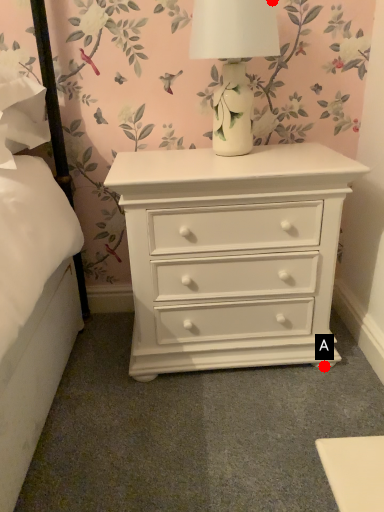
Question: Two points are circled on the image, labeled by A and B beside each circle. Among these points, which one is nearest to the camera?

Choices:
 (A) A is closer
 (B) B is closer

Answer: (B)